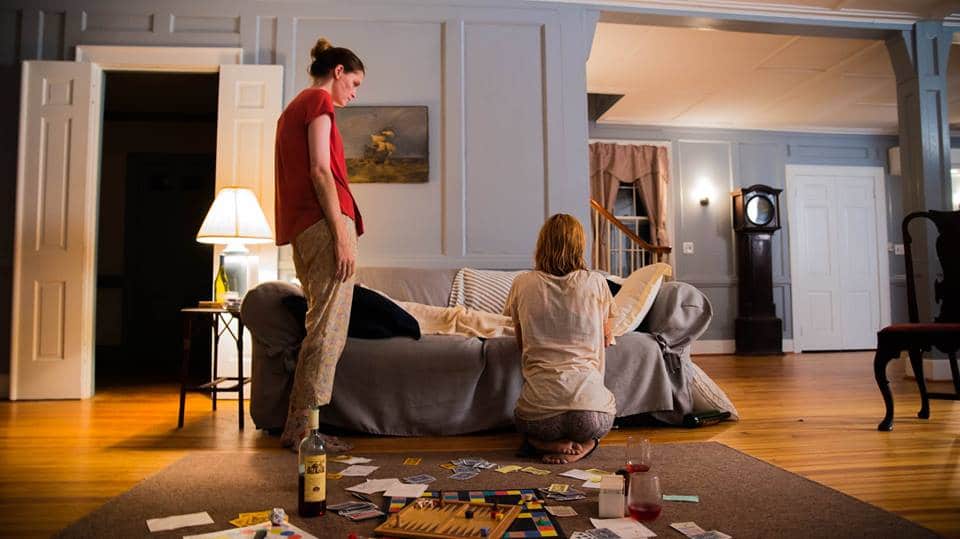
Where is `grandfather clock`? Image resolution: width=960 pixels, height=539 pixels. grandfather clock is located at coordinates (755, 276).